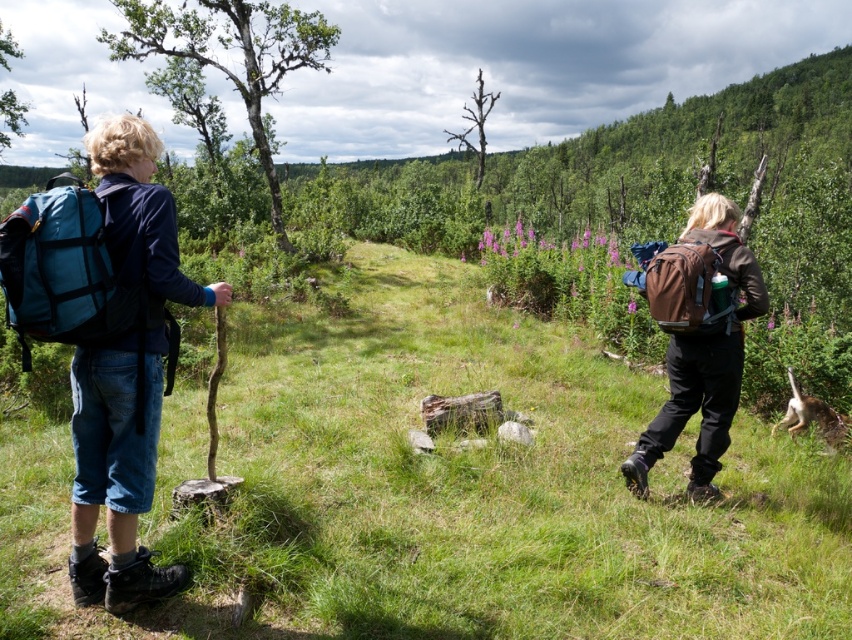
Can you confirm if teal fabric backpack at left is positioned below brown canvas backpack at right?

Incorrect, teal fabric backpack at left is not positioned below brown canvas backpack at right.

Is teal fabric backpack at left to the left of brown canvas backpack at right from the viewer's perspective?

Correct, you'll find teal fabric backpack at left to the left of brown canvas backpack at right.

Locate an element on the screen. The width and height of the screenshot is (852, 640). teal fabric backpack at left is located at coordinates (64, 272).

Who is positioned more to the left, green grassy at center or brown canvas backpack at right?

From the viewer's perspective, green grassy at center appears more on the left side.

Is point (413, 618) positioned behind point (701, 268)?

No, it is in front of (701, 268).

Describe the element at coordinates (441, 490) in the screenshot. I see `green grassy at center` at that location.

In order to click on green grassy at center in this screenshot , I will do `click(441, 490)`.

Is brown fabric backpack at right behind teal fabric backpack at left?

Yes, brown fabric backpack at right is further from the viewer.

Does brown fabric backpack at right have a greater width compared to teal fabric backpack at left?

Yes, brown fabric backpack at right is wider than teal fabric backpack at left.

Between point (661, 444) and point (79, 300), which one is positioned in front?

Point (79, 300) is in front.

Find the location of a particular element. brown fabric backpack at right is located at coordinates (698, 340).